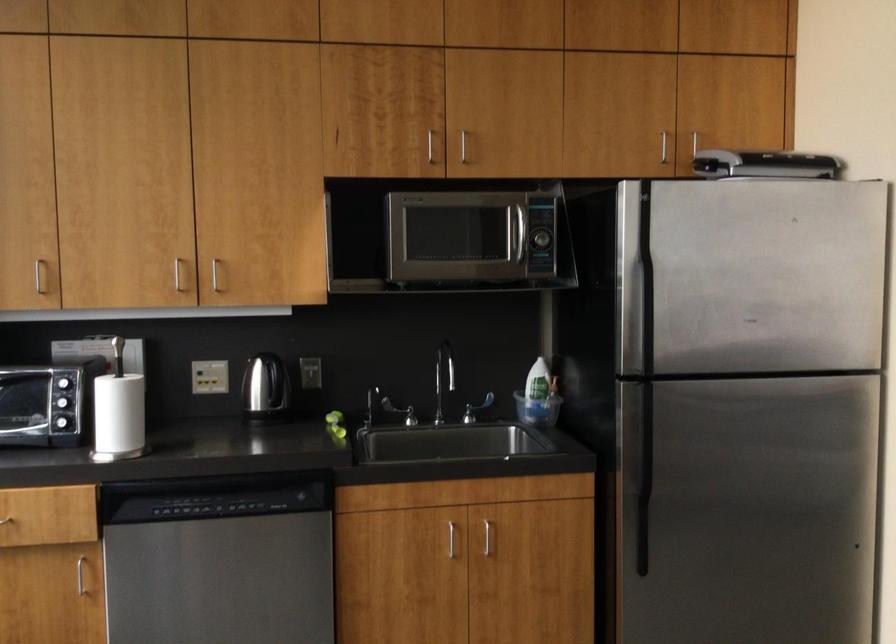
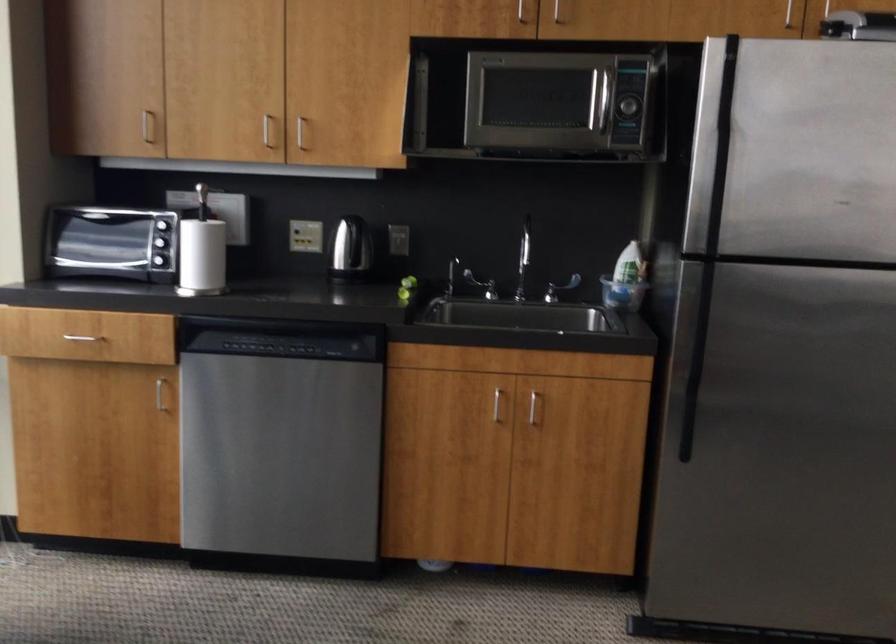
Find the pixel in the second image that matches [126,444] in the first image.

(202, 281)